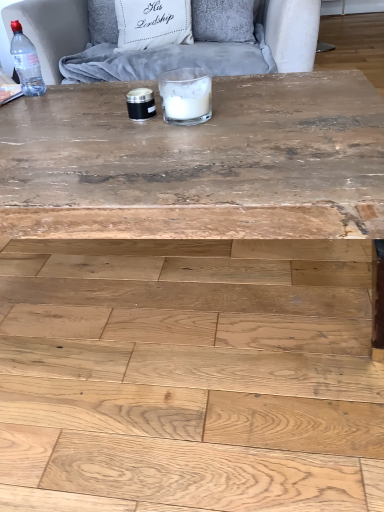
Question: Is transparent plastic bottle at top left shorter than natural wood plywood at lower center?

Choices:
 (A) yes
 (B) no

Answer: (B)

Question: From a real-world perspective, is transparent plastic bottle at top left over natural wood plywood at lower center?

Choices:
 (A) yes
 (B) no

Answer: (A)

Question: Could natural wood plywood at lower center be considered to be inside transparent plastic bottle at top left?

Choices:
 (A) no
 (B) yes

Answer: (A)

Question: Does transparent plastic bottle at top left have a greater width compared to natural wood plywood at lower center?

Choices:
 (A) yes
 (B) no

Answer: (B)

Question: Considering the relative positions of transparent plastic bottle at top left and natural wood plywood at lower center in the image provided, is transparent plastic bottle at top left to the right of natural wood plywood at lower center from the viewer's perspective?

Choices:
 (A) no
 (B) yes

Answer: (A)

Question: Is transparent plastic bottle at top left directly adjacent to natural wood plywood at lower center?

Choices:
 (A) no
 (B) yes

Answer: (A)

Question: Does wooden coffee table at center have a lesser height compared to white fabric pillow at upper center?

Choices:
 (A) yes
 (B) no

Answer: (B)

Question: Does wooden coffee table at center have a lesser width compared to white fabric pillow at upper center?

Choices:
 (A) yes
 (B) no

Answer: (B)

Question: From a real-world perspective, is wooden coffee table at center located beneath white fabric pillow at upper center?

Choices:
 (A) yes
 (B) no

Answer: (A)

Question: Is wooden coffee table at center outside white fabric pillow at upper center?

Choices:
 (A) yes
 (B) no

Answer: (A)

Question: From the image's perspective, would you say wooden coffee table at center is positioned over white fabric pillow at upper center?

Choices:
 (A) no
 (B) yes

Answer: (A)

Question: Is wooden coffee table at center facing away from white fabric pillow at upper center?

Choices:
 (A) yes
 (B) no

Answer: (B)

Question: Is transparent plastic bottle at top left oriented away from white glass candle at center?

Choices:
 (A) yes
 (B) no

Answer: (B)